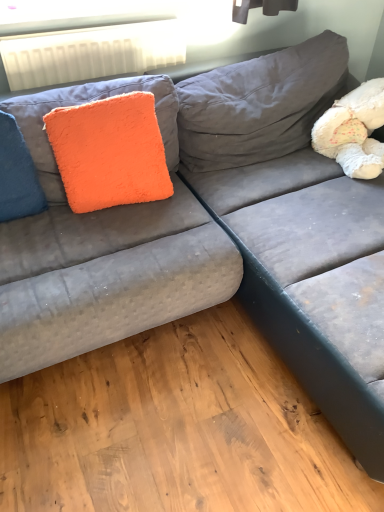
Question: Can you confirm if white fluffy teddy bear at upper right is bigger than white plastic radiator at upper left?

Choices:
 (A) yes
 (B) no

Answer: (A)

Question: Are white fluffy teddy bear at upper right and white plastic radiator at upper left beside each other?

Choices:
 (A) no
 (B) yes

Answer: (A)

Question: Does white fluffy teddy bear at upper right appear on the right side of white plastic radiator at upper left?

Choices:
 (A) no
 (B) yes

Answer: (B)

Question: Is white fluffy teddy bear at upper right aimed at white plastic radiator at upper left?

Choices:
 (A) no
 (B) yes

Answer: (A)

Question: Is white fluffy teddy bear at upper right smaller than white plastic radiator at upper left?

Choices:
 (A) no
 (B) yes

Answer: (A)

Question: Is white fluffy teddy bear at upper right wider than white plastic radiator at upper left?

Choices:
 (A) no
 (B) yes

Answer: (B)

Question: Does blue fuzzy pillow at left have a smaller size compared to white fluffy teddy bear at upper right?

Choices:
 (A) no
 (B) yes

Answer: (B)

Question: From the image's perspective, would you say blue fuzzy pillow at left is shown under white fluffy teddy bear at upper right?

Choices:
 (A) no
 (B) yes

Answer: (B)

Question: Is blue fuzzy pillow at left next to white fluffy teddy bear at upper right and touching it?

Choices:
 (A) no
 (B) yes

Answer: (A)

Question: Considering the relative sizes of blue fuzzy pillow at left and white fluffy teddy bear at upper right in the image provided, is blue fuzzy pillow at left bigger than white fluffy teddy bear at upper right?

Choices:
 (A) yes
 (B) no

Answer: (B)

Question: Does blue fuzzy pillow at left lie behind white fluffy teddy bear at upper right?

Choices:
 (A) yes
 (B) no

Answer: (B)

Question: Is blue fuzzy pillow at left at the right side of white fluffy teddy bear at upper right?

Choices:
 (A) yes
 (B) no

Answer: (B)

Question: Considering the relative positions of blue fuzzy pillow at left and orange fluffy pillow at upper left in the image provided, is blue fuzzy pillow at left to the left of orange fluffy pillow at upper left from the viewer's perspective?

Choices:
 (A) no
 (B) yes

Answer: (B)